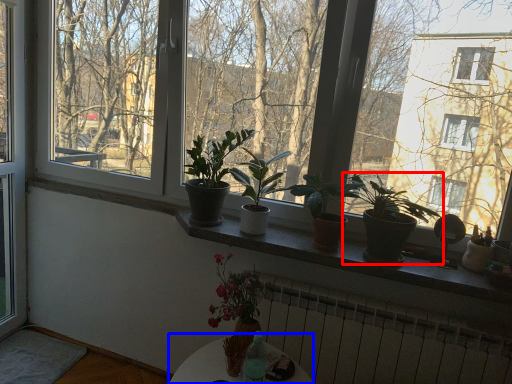
Question: Which point is further to the camera, houseplant (highlighted by a red box) or round table (highlighted by a blue box)?

Choices:
 (A) houseplant
 (B) round table

Answer: (A)